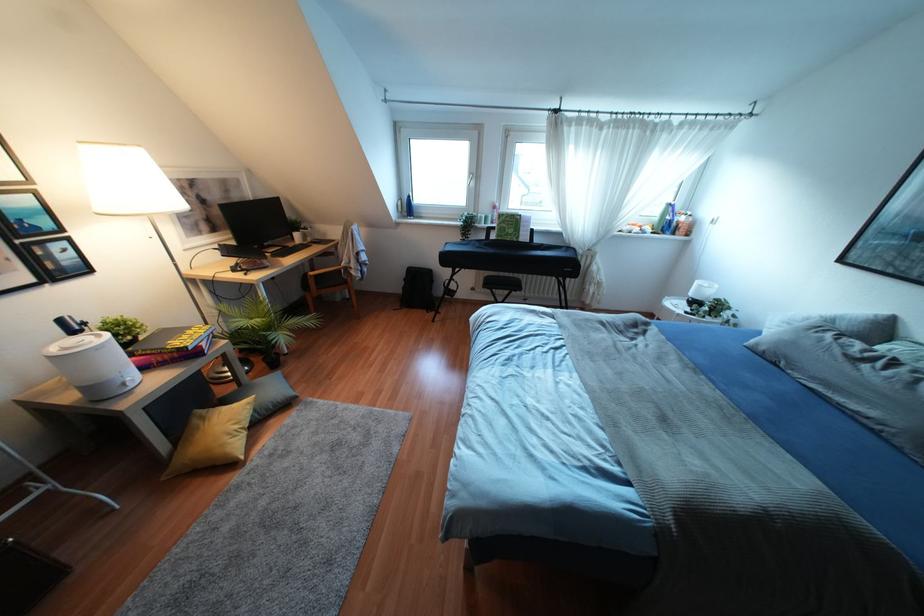
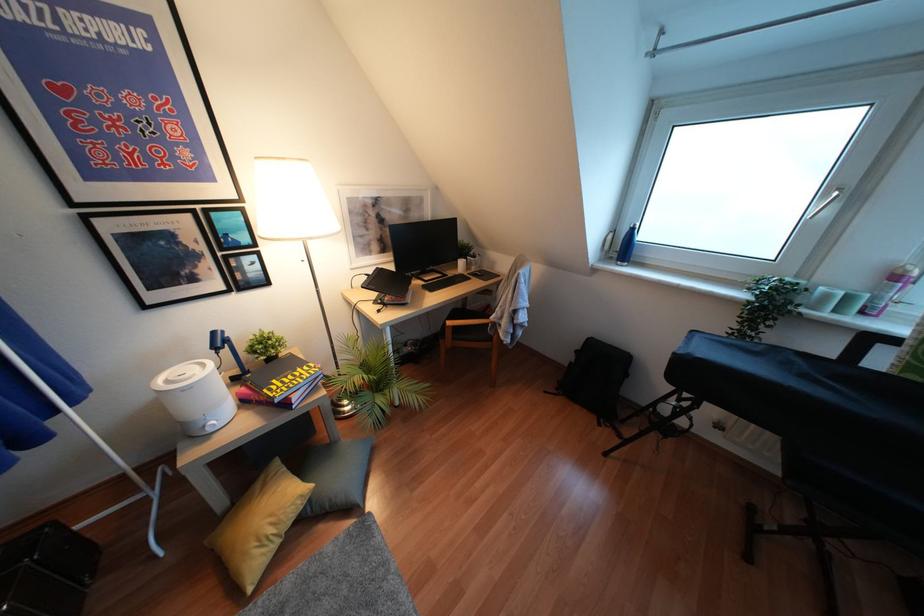
Find the pixel in the second image that matches point (407, 208) in the first image.

(623, 246)